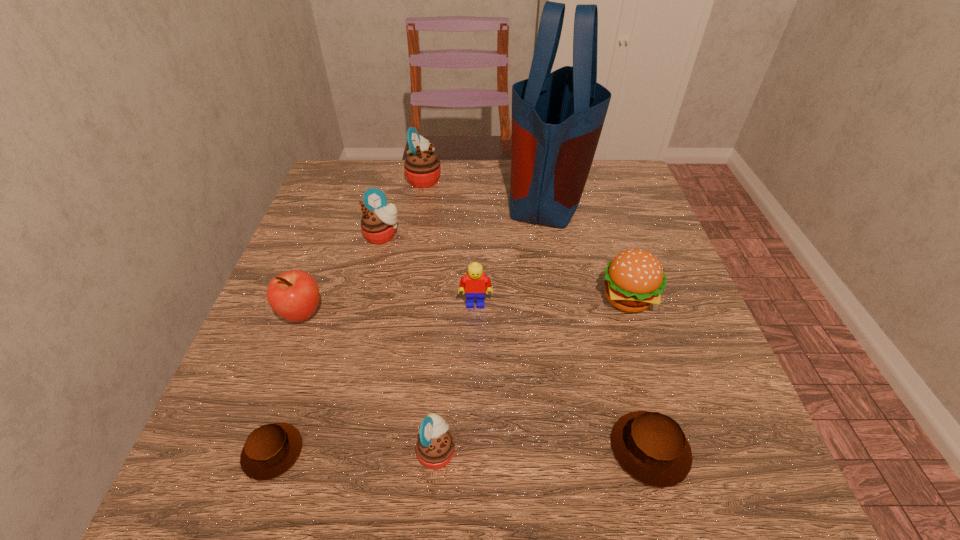
Identify the location of the closest object to the biggest pink muffin. The width and height of the screenshot is (960, 540). (378, 224).

Select which object is the sixth closest to the second smallest pink muffin. Please provide its 2D coordinates. Your answer should be formatted as a tuple, i.e. [(x, y)], where the tuple contains the x and y coordinates of a point satisfying the conditions above.

[(634, 279)]

Point out which muffin is positioned as the third nearest to the apple. Please provide its 2D coordinates. Your answer should be formatted as a tuple, i.e. [(x, y)], where the tuple contains the x and y coordinates of a point satisfying the conditions above.

[(435, 446)]

Locate which muffin is the second closest to the shortest object. Please provide its 2D coordinates. Your answer should be formatted as a tuple, i.e. [(x, y)], where the tuple contains the x and y coordinates of a point satisfying the conditions above.

[(378, 224)]

Where is `the second closest pink muffin relative to the rightmost muffin`? the second closest pink muffin relative to the rightmost muffin is located at coordinates (378, 224).

Point out which pink muffin is positioned as the second nearest to the fourth nearest muffin. Please provide its 2D coordinates. Your answer should be formatted as a tuple, i.e. [(x, y)], where the tuple contains the x and y coordinates of a point satisfying the conditions above.

[(435, 446)]

Locate an element on the screen. The image size is (960, 540). vacant region that satisfies the following two spatial constraints: 1. on the front-facing side of the Lego; 2. on the left side of the bigger brown muffin is located at coordinates (474, 449).

In order to click on vacant space that satisfies the following two spatial constraints: 1. on the front-facing side of the yellow Lego; 2. on the front-facing side of the seventh tallest object in this screenshot , I will do click(474, 450).

This screenshot has width=960, height=540. I want to click on vacant area in the image that satisfies the following two spatial constraints: 1. on the front-facing side of the farthest muffin; 2. on the left side of the red handbag, so click(x=421, y=193).

The width and height of the screenshot is (960, 540). In order to click on free space that satisfies the following two spatial constraints: 1. on the front-facing side of the hamburger; 2. on the right side of the eighth shortest object in this screenshot , I will do `click(404, 299)`.